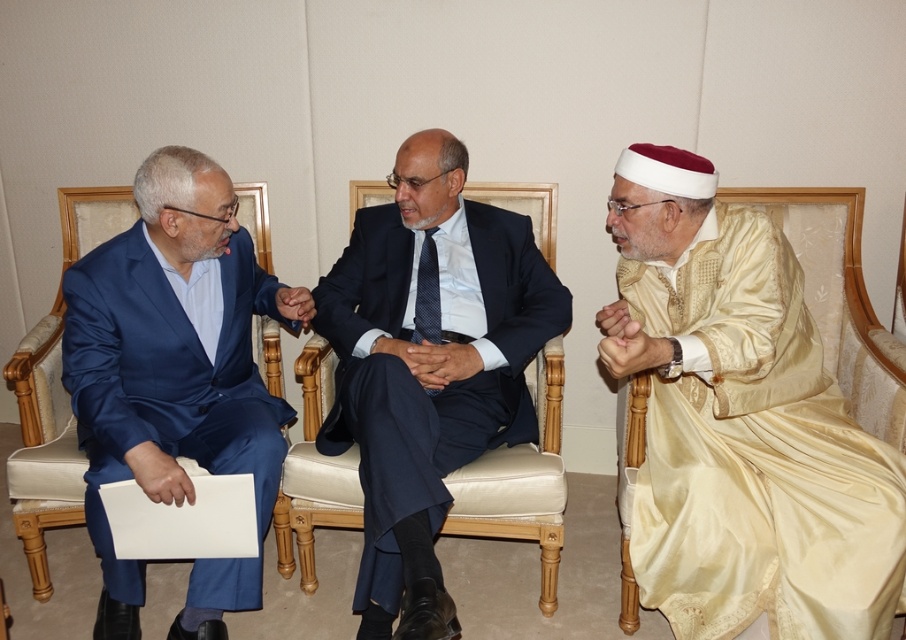
Question: Among these points, which one is nearest to the camera?

Choices:
 (A) pyautogui.click(x=767, y=337)
 (B) pyautogui.click(x=169, y=429)

Answer: (A)

Question: Which point is closer to the camera taking this photo?

Choices:
 (A) (398, 253)
 (B) (230, 243)

Answer: (B)

Question: Which of the following is the closest to the observer?

Choices:
 (A) matte black suit at center
 (B) gold satin robe at right

Answer: (A)

Question: Is matte black suit at center below satin blue suit at left?

Choices:
 (A) no
 (B) yes

Answer: (A)

Question: Is matte black suit at center positioned in front of satin blue suit at left?

Choices:
 (A) no
 (B) yes

Answer: (B)

Question: Observing the image, what is the correct spatial positioning of matte black suit at center in reference to satin blue suit at left?

Choices:
 (A) left
 (B) right

Answer: (B)